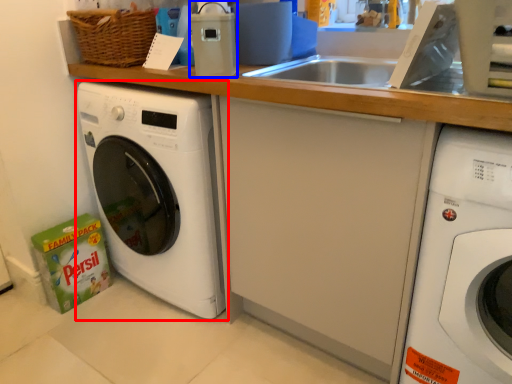
Question: Which of the following is the closest to the observer, washing machine (highlighted by a red box) or appliance (highlighted by a blue box)?

Choices:
 (A) washing machine
 (B) appliance

Answer: (B)